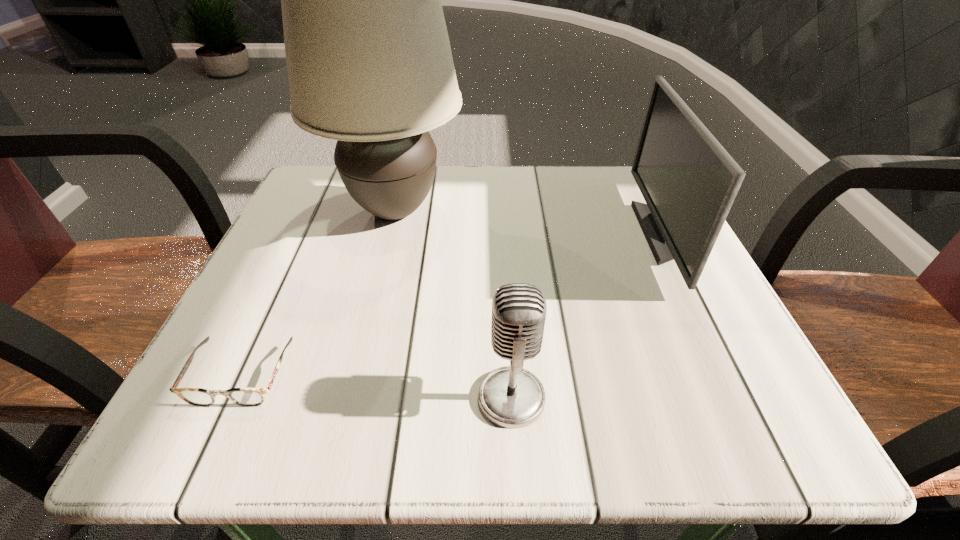
Identify the location of free space between the lampshade and the monitor. This screenshot has height=540, width=960. (529, 222).

Where is `unoccupied area between the microphone and the spectacles`? unoccupied area between the microphone and the spectacles is located at coordinates (376, 387).

The height and width of the screenshot is (540, 960). I want to click on vacant space in between the tallest object and the second object from right to left, so click(x=453, y=304).

At what (x,y) coordinates should I click in order to perform the action: click on empty space between the second shortest object and the lampshade. Please return your answer as a coordinate pair (x, y). The width and height of the screenshot is (960, 540). Looking at the image, I should click on (453, 304).

At what (x,y) coordinates should I click in order to perform the action: click on vacant space that is in between the lampshade and the third shortest object. Please return your answer as a coordinate pair (x, y). The height and width of the screenshot is (540, 960). Looking at the image, I should click on (529, 222).

Locate an element on the screen. The height and width of the screenshot is (540, 960). vacant point located between the monitor and the lampshade is located at coordinates (529, 222).

This screenshot has height=540, width=960. I want to click on unoccupied position between the third shortest object and the spectacles, so click(452, 304).

Locate an element on the screen. object that can be found as the closest to the microphone is located at coordinates (369, 62).

Where is `object identified as the third closest to the third tallest object`? This screenshot has height=540, width=960. object identified as the third closest to the third tallest object is located at coordinates (248, 397).

Find the location of a particular element. The image size is (960, 540). vacant space that satisfies the following two spatial constraints: 1. on the frame of the shortest object; 2. on the left side of the second object from right to left is located at coordinates (231, 397).